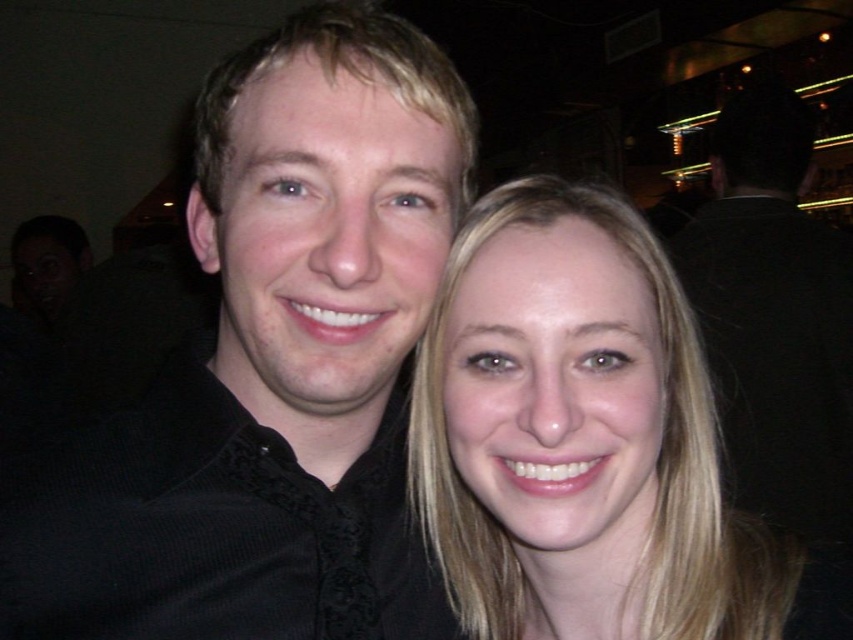
Question: Does black textured shirt at center have a lesser width compared to blonde hair at center?

Choices:
 (A) no
 (B) yes

Answer: (A)

Question: Which point is farther to the camera?

Choices:
 (A) black textured shirt at center
 (B) blonde hair at center

Answer: (A)

Question: Can you confirm if black textured shirt at center is smaller than blonde hair at center?

Choices:
 (A) yes
 (B) no

Answer: (B)

Question: Which point is closer to the camera?

Choices:
 (A) (225, 195)
 (B) (624, 536)

Answer: (A)

Question: Considering the relative positions of black textured shirt at center and blonde hair at center in the image provided, where is black textured shirt at center located with respect to blonde hair at center?

Choices:
 (A) above
 (B) below

Answer: (A)